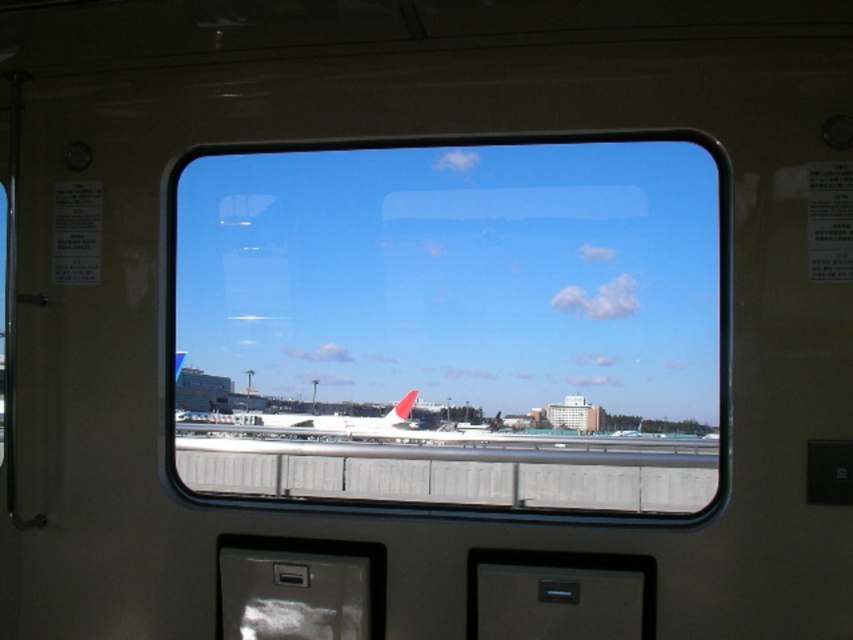
You are a passenger sitting in the train and looking out through the window. You notice the transparent glass airplane window at center and the white matte airplane at center. Which object is larger in your view?

The transparent glass airplane window at center is bigger than the white matte airplane at center, so the transparent glass airplane window at center appears larger in your view.

You are sitting in the train and looking out the window. You see the transparent glass airplane window at center and the white matte airplane at center. Which object is closer to the right edge of the window frame?

The transparent glass airplane window at center is to the right of white matte airplane at center, so it is closer to the right edge of the window frame.

You are a passenger sitting in the train and looking out the window. You see the transparent glass airplane window at center and the white matte airplane at center. Which object is closer to the top of the window frame?

The transparent glass airplane window at center is located above the white matte airplane at center, so the transparent glass airplane window at center is closer to the top of the window frame.